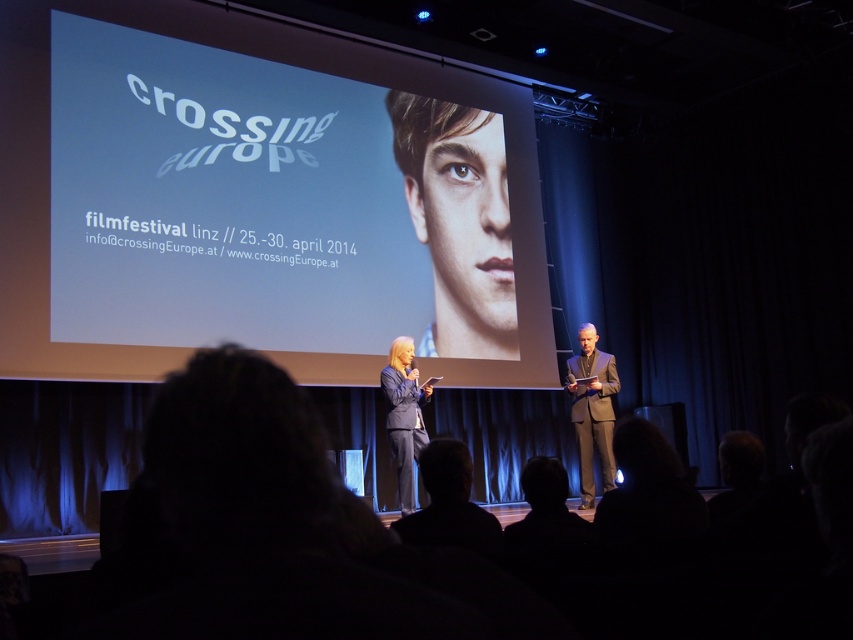
Question: Which point is farther to the camera?

Choices:
 (A) white glossy screen at upper center
 (B) smooth skin portrait at center
 (C) dark gray suit at right

Answer: (B)

Question: Can you confirm if white glossy screen at upper center is positioned to the left of matte black suit at center?

Choices:
 (A) yes
 (B) no

Answer: (A)

Question: Which of the following is the closest to the observer?

Choices:
 (A) (376, 336)
 (B) (451, 285)
 (C) (410, 512)

Answer: (C)

Question: Can you confirm if smooth skin portrait at center is positioned to the left of dark gray suit at right?

Choices:
 (A) yes
 (B) no

Answer: (A)

Question: Which of the following is the farthest from the observer?

Choices:
 (A) white glossy screen at upper center
 (B) matte black suit at center
 (C) dark gray suit at right

Answer: (C)

Question: Does white glossy screen at upper center appear over smooth skin portrait at center?

Choices:
 (A) no
 (B) yes

Answer: (B)